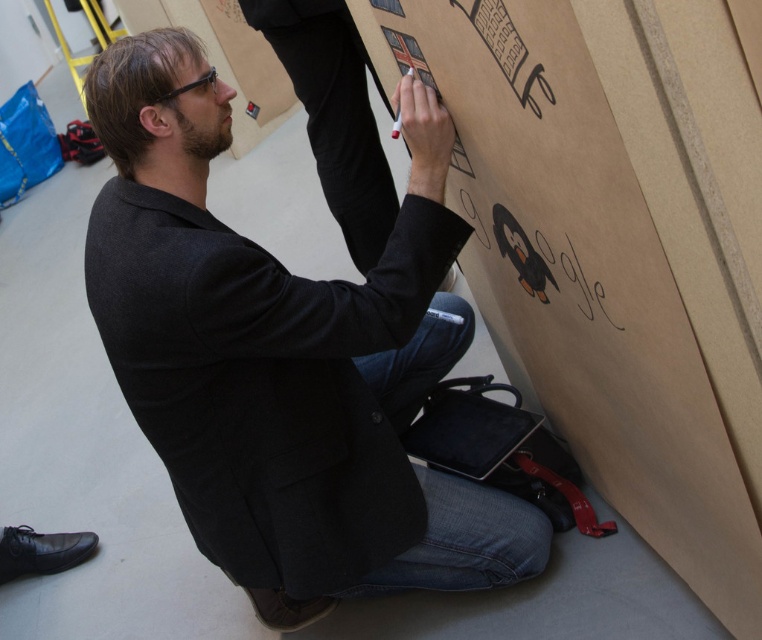
You are standing in the room where the man is working. You want to place a 60 cm ruler on the brown cardboard at center. Can you fit it entirely on the cardboard?

The brown cardboard at center is 58.58 centimeters away from the viewer. The distance does not indicate the size of the cardboard, so we cannot determine if the 60 cm ruler will fit. More information about the cardboard size is needed.

You are an assistant helping to organize a workshop. You need to place the brown cardboard at center and the dark gray woolen blazer at center on a shelf. The shelf has a width of 1.2 meters. Can both items fit side by side without overlapping?

The brown cardboard at center has a lesser width compared to dark gray woolen blazer at center. However, since the total width of both items combined is not provided, it is impossible to determine if they can fit on the shelf together. Please measure the individual widths of both items to ensure they fit within the 1.2 meters shelf width.